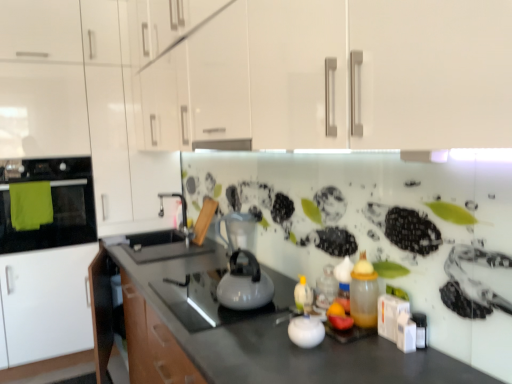
Question: From a real-world perspective, is white glossy kettle at center below translucent plastic bottle at center, which ranks as the second bottle in front-to-back order?

Choices:
 (A) yes
 (B) no

Answer: (B)

Question: Does white glossy kettle at center appear on the left side of translucent plastic bottle at center, which is the first bottle in back-to-front order?

Choices:
 (A) yes
 (B) no

Answer: (A)

Question: Is white glossy kettle at center turned away from translucent plastic bottle at center, which ranks as the second bottle in front-to-back order?

Choices:
 (A) yes
 (B) no

Answer: (B)

Question: Does white glossy kettle at center appear on the right side of translucent plastic bottle at center, which ranks as the second bottle in front-to-back order?

Choices:
 (A) yes
 (B) no

Answer: (B)

Question: From a real-world perspective, is white glossy kettle at center positioned over translucent plastic bottle at center, which is the first bottle in back-to-front order, based on gravity?

Choices:
 (A) yes
 (B) no

Answer: (A)

Question: In terms of size, does translucent plastic bottle at center-right, which ranks as the first bottle in front-to-back order, appear bigger or smaller than green fabric oven at left?

Choices:
 (A) small
 (B) big

Answer: (A)

Question: From the image's perspective, relative to green fabric oven at left, is translucent plastic bottle at center-right, positioned as the 2th bottle in back-to-front order, above or below?

Choices:
 (A) above
 (B) below

Answer: (B)

Question: Considering the positions of translucent plastic bottle at center-right, positioned as the 2th bottle in back-to-front order, and green fabric oven at left in the image, is translucent plastic bottle at center-right, positioned as the 2th bottle in back-to-front order, wider or thinner than green fabric oven at left?

Choices:
 (A) thin
 (B) wide

Answer: (A)

Question: Does point (362, 291) appear closer or farther from the camera than point (73, 206)?

Choices:
 (A) closer
 (B) farther

Answer: (A)

Question: In terms of height, does green fabric oven at left look taller or shorter compared to white glossy jar at center, the second appliance viewed from the left?

Choices:
 (A) short
 (B) tall

Answer: (B)

Question: Is green fabric oven at left wider or thinner than white glossy jar at center, the second appliance viewed from the left?

Choices:
 (A) thin
 (B) wide

Answer: (B)

Question: From the image's perspective, is green fabric oven at left above or below white glossy jar at center, the first appliance positioned from the bottom?

Choices:
 (A) above
 (B) below

Answer: (A)

Question: Looking at the image, does green fabric oven at left seem bigger or smaller compared to white glossy jar at center, the second appliance viewed from the left?

Choices:
 (A) big
 (B) small

Answer: (A)

Question: Considering the positions of translucent plastic bottle at center-right, positioned as the 2th bottle in back-to-front order, and white glossy jar at center, the second appliance viewed from the back, in the image, is translucent plastic bottle at center-right, positioned as the 2th bottle in back-to-front order, taller or shorter than white glossy jar at center, the second appliance viewed from the back,?

Choices:
 (A) tall
 (B) short

Answer: (A)

Question: In the image, is translucent plastic bottle at center-right, positioned as the 2th bottle in back-to-front order, positioned in front of or behind white glossy jar at center, the second appliance viewed from the left?

Choices:
 (A) behind
 (B) front

Answer: (A)